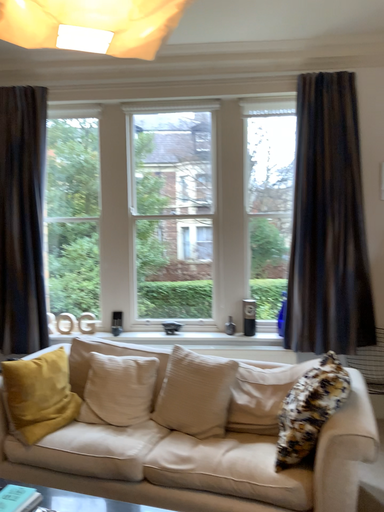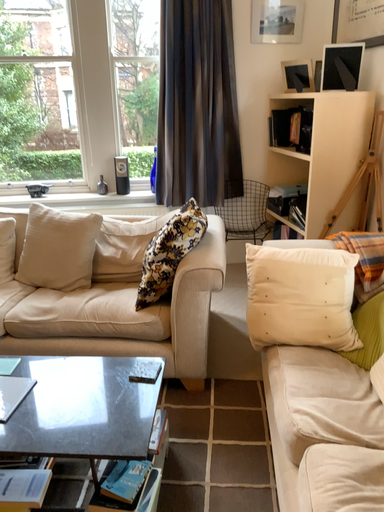
Question: Which way did the camera rotate in the video?

Choices:
 (A) rotated downward
 (B) rotated upward

Answer: (A)